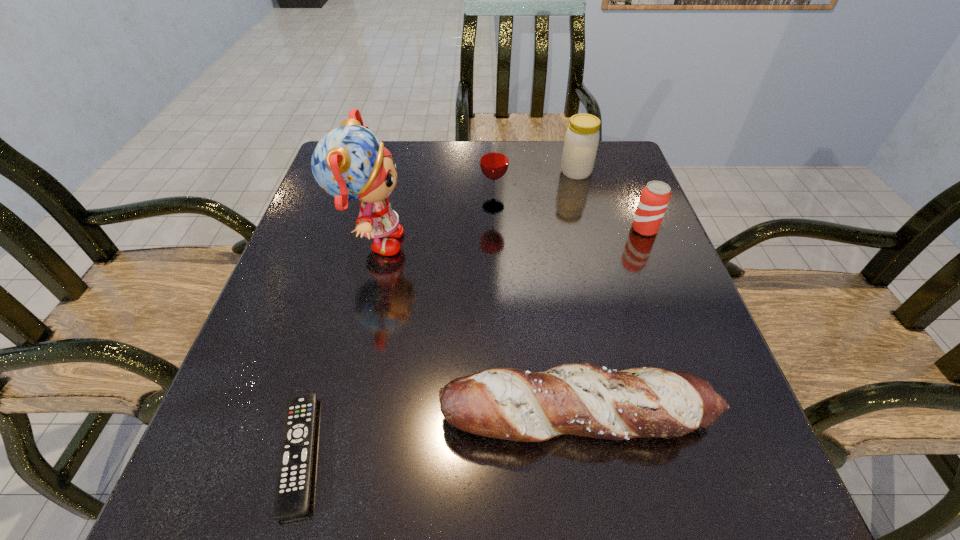
Where is `the tallest object`? the tallest object is located at coordinates (350, 163).

This screenshot has width=960, height=540. I want to click on glass, so click(494, 159).

What are the coordinates of `jar` in the screenshot? It's located at (581, 142).

The height and width of the screenshot is (540, 960). Identify the location of beer can. (655, 196).

This screenshot has width=960, height=540. I want to click on the second shortest object, so click(x=583, y=399).

This screenshot has width=960, height=540. Find the location of `the shortest object`. the shortest object is located at coordinates (293, 485).

You are a GUI agent. You are given a task and a screenshot of the screen. Output one action in this format:
    pyautogui.click(x=<x>, y=<y>)
    Task: Click on the vacant area situated on the face of the doll
    The height and width of the screenshot is (540, 960).
    Given the screenshot: What is the action you would take?
    pyautogui.click(x=521, y=244)

Where is `free space located on the left of the glass`? This screenshot has width=960, height=540. free space located on the left of the glass is located at coordinates (355, 207).

Identify the location of vacant space located on the left of the jar. Image resolution: width=960 pixels, height=540 pixels. (491, 172).

I want to click on vacant space located on the front of the beer can, so click(x=667, y=286).